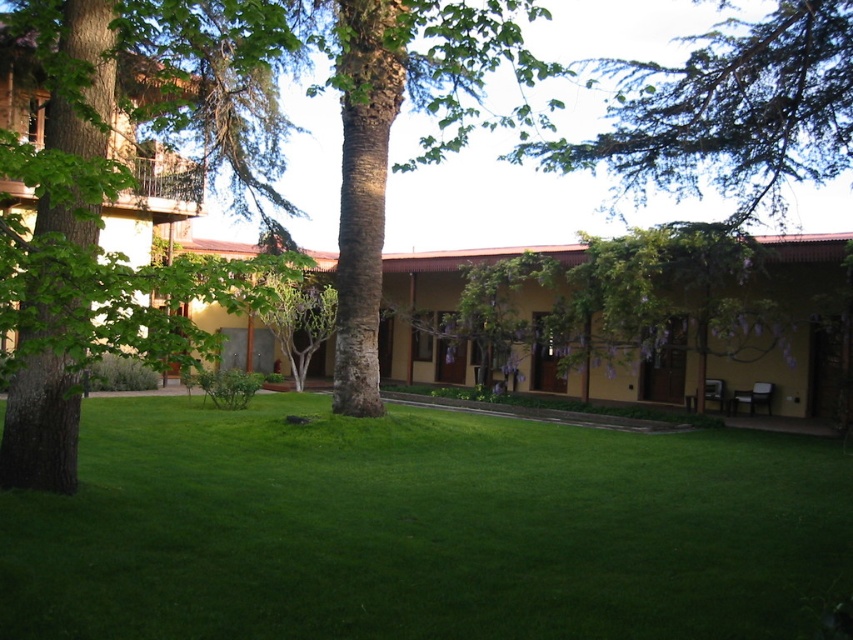
In the scene shown: You are planning to place a picnic blanket in the grassy area. Considering the green leafy tree at left and the yellow matte building at center, which object is narrower so that there is more space between it and the other object?

The green leafy tree at left has a lesser width compared to the yellow matte building at center, so there is more space between the green leafy tree at left and the yellow matte building at center.

You are standing in the outdoor area and want to take a photo of the yellow matte building at center without the green leafy tree at left blocking the view. Which direction should you move to ensure the tree is no longer in front of the building?

The green leafy tree at left is in front of the yellow matte building at center, so to avoid blocking the view, move to the right side of the scene where the tree is no longer between you and the building.

You are standing in the outdoor scene and want to walk towards the building in the background. Which object, the green grass at center or the green leafy tree at upper center, would you pass first?

You would pass the green grass at center first because it is closer to the viewer than the green leafy tree at upper center.